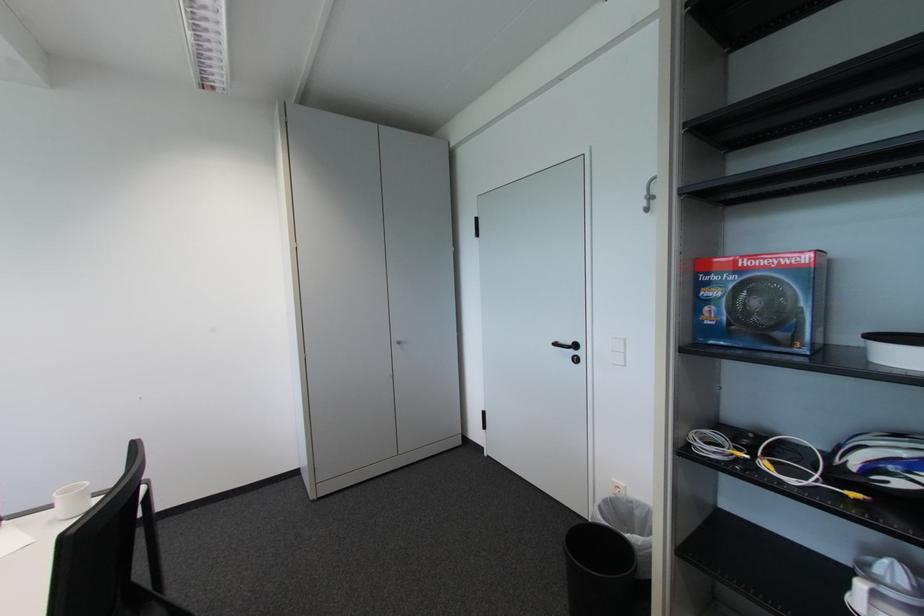
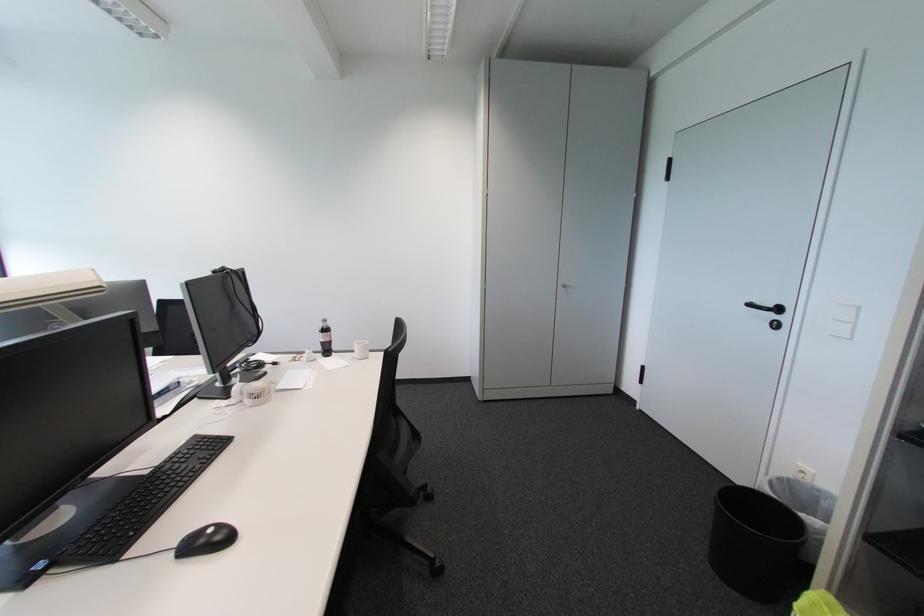
The point at (x=578, y=353) is marked in the first image. Where is the corresponding point in the second image?

(777, 317)